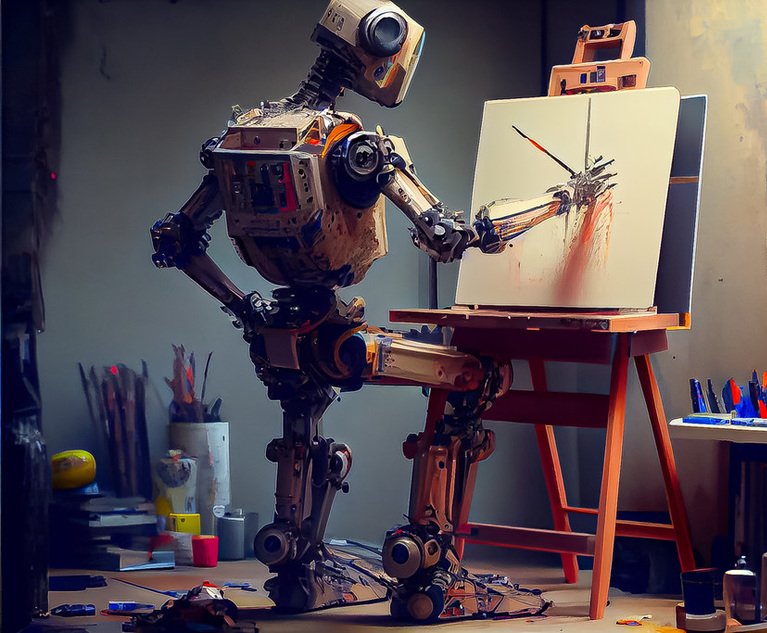
The image size is (767, 633). What are the coordinates of `floor` in the screenshot? It's located at (561, 622).